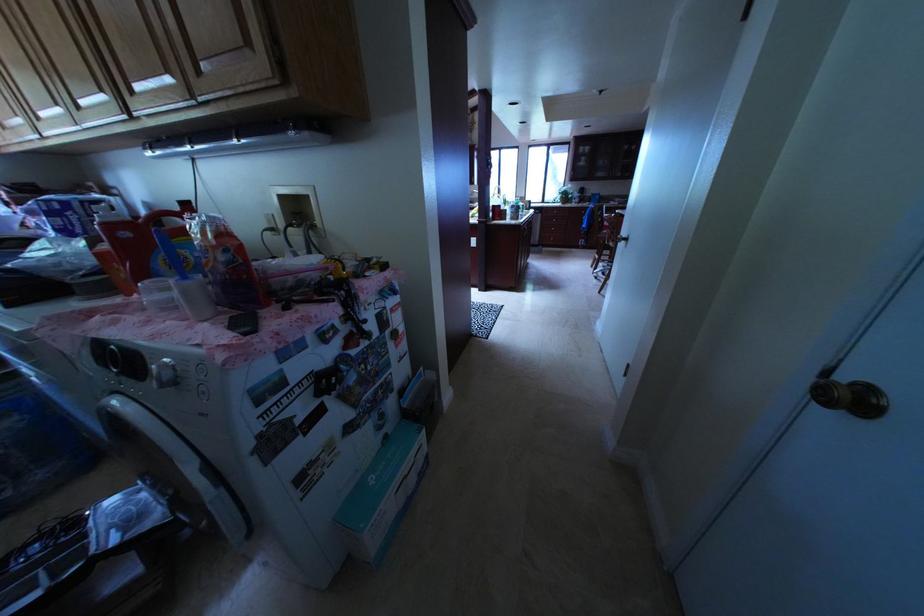
Where is `clear plastic cup`? Image resolution: width=924 pixels, height=616 pixels. clear plastic cup is located at coordinates (195, 297).